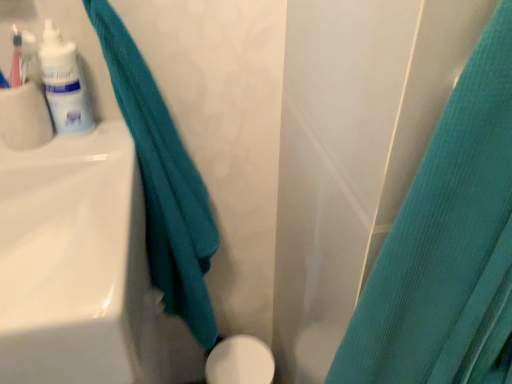
Question: Can you confirm if white glossy porcelain at lower center is smaller than teal fabric curtain at right, which is the 2th curtain from left to right?

Choices:
 (A) no
 (B) yes

Answer: (B)

Question: From a real-world perspective, does white glossy porcelain at lower center stand above teal fabric curtain at right, which is the 2th curtain from left to right?

Choices:
 (A) yes
 (B) no

Answer: (B)

Question: Is white glossy porcelain at lower center next to teal fabric curtain at right, which is the first curtain from right to left?

Choices:
 (A) no
 (B) yes

Answer: (A)

Question: Considering the relative sizes of white glossy porcelain at lower center and teal fabric curtain at right, which is the first curtain from right to left, in the image provided, is white glossy porcelain at lower center shorter than teal fabric curtain at right, which is the first curtain from right to left,?

Choices:
 (A) yes
 (B) no

Answer: (A)

Question: Is teal fabric curtain at right, which is the first curtain from right to left, at the back of white glossy porcelain at lower center?

Choices:
 (A) no
 (B) yes

Answer: (A)

Question: From the image's perspective, is teal fabric curtain at right, which is the first curtain from right to left, located above or below white glossy lotion at upper left?

Choices:
 (A) above
 (B) below

Answer: (B)

Question: From a real-world perspective, is teal fabric curtain at right, which is the first curtain from right to left, positioned above or below white glossy lotion at upper left?

Choices:
 (A) below
 (B) above

Answer: (A)

Question: Is teal fabric curtain at right, which is the first curtain from right to left, taller or shorter than white glossy lotion at upper left?

Choices:
 (A) short
 (B) tall

Answer: (B)

Question: Considering the positions of teal fabric curtain at right, which is the first curtain from right to left, and white glossy lotion at upper left in the image, is teal fabric curtain at right, which is the first curtain from right to left, wider or thinner than white glossy lotion at upper left?

Choices:
 (A) wide
 (B) thin

Answer: (A)

Question: Is white glossy lotion at upper left in front of or behind white glossy sink at left in the image?

Choices:
 (A) behind
 (B) front

Answer: (A)

Question: Looking at the image, does white glossy lotion at upper left seem bigger or smaller compared to white glossy sink at left?

Choices:
 (A) big
 (B) small

Answer: (B)

Question: From the image's perspective, relative to white glossy sink at left, is white glossy lotion at upper left above or below?

Choices:
 (A) above
 (B) below

Answer: (A)

Question: From a real-world perspective, is white glossy lotion at upper left physically located above or below white glossy sink at left?

Choices:
 (A) above
 (B) below

Answer: (A)

Question: From a real-world perspective, relative to white glossy lotion at upper left, is teal fabric towel at left, the 1th curtain positioned from the left, vertically above or below?

Choices:
 (A) below
 (B) above

Answer: (A)

Question: From their relative heights in the image, would you say teal fabric towel at left, the second curtain in the right-to-left sequence, is taller or shorter than white glossy lotion at upper left?

Choices:
 (A) short
 (B) tall

Answer: (B)